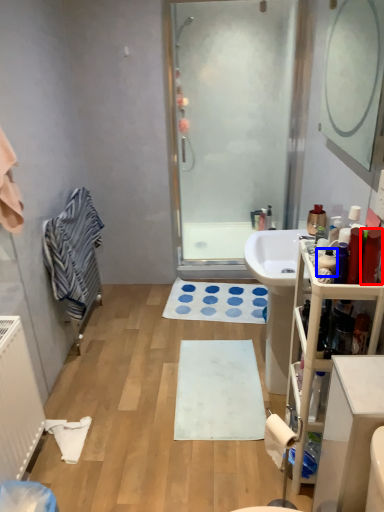
Question: Among these objects, which one is nearest to the camera, toiletry (highlighted by a red box) or toiletry (highlighted by a blue box)?

Choices:
 (A) toiletry
 (B) toiletry

Answer: (A)